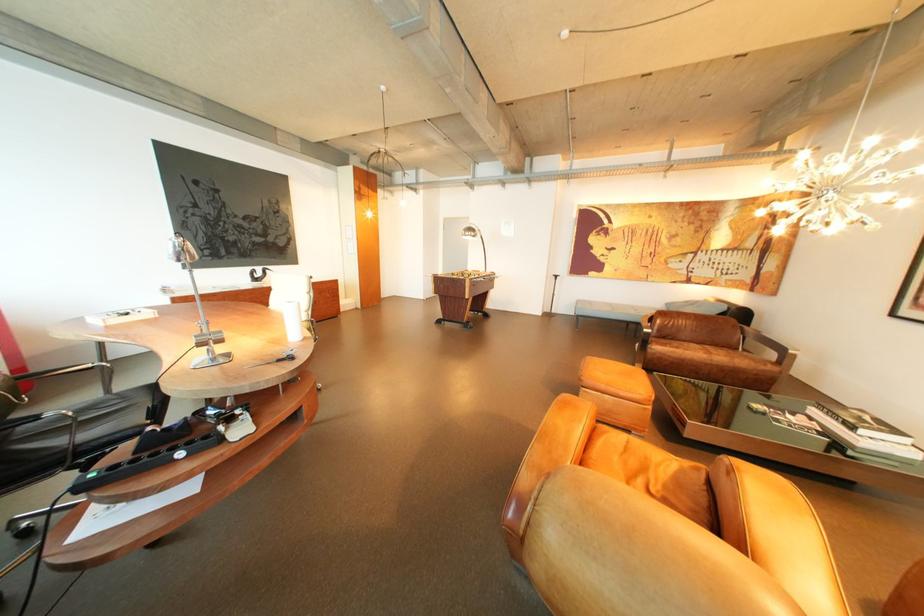
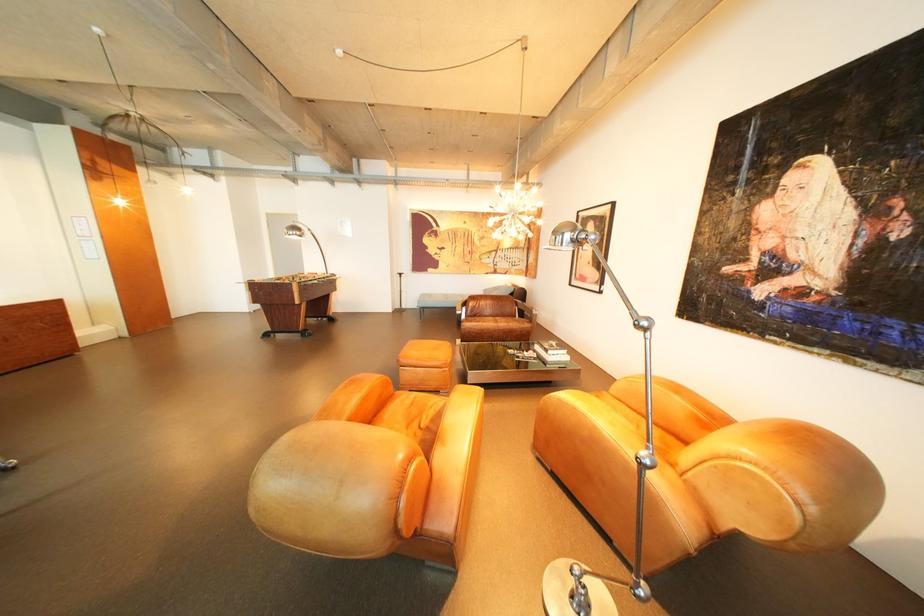
The point at (845, 415) is marked in the first image. Where is the corresponding point in the second image?

(554, 347)